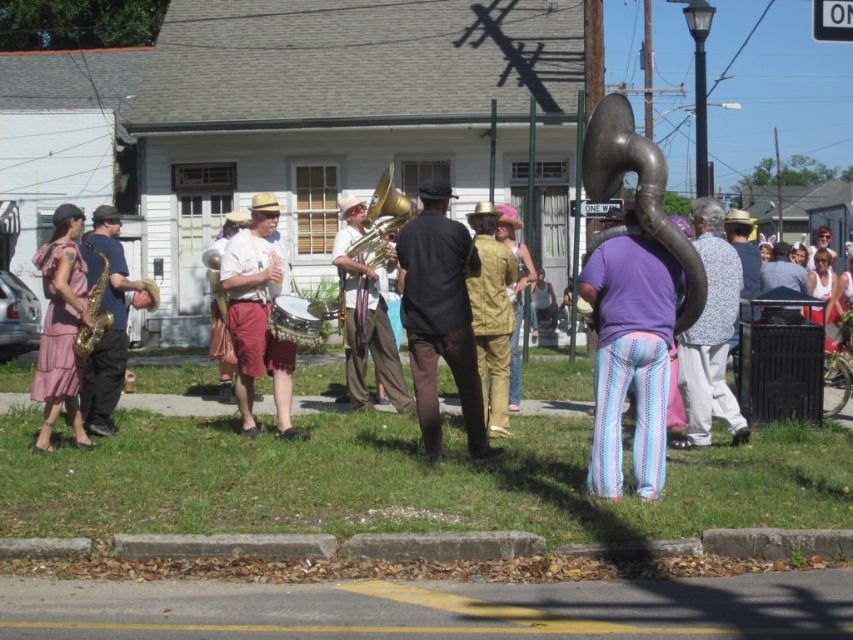
You are standing at the camera position and want to throw a ball to hit the point at coordinates [442,301]. What is the approximate distance you need to throw the ball?

The point at coordinates [442,301] is approximately 32.18 feet away from the camera, so you need to throw the ball about 32.18 feet.

You are a photographer standing 10 meters away from the light brown leather shorts at center and the light brown leather jacket at center. Can you fit both items in your camera frame if your camera has a maximum field of view of 12 meters width?

The light brown leather shorts at center and light brown leather jacket at center are 11.09 meters apart from each other. Since the distance between them is less than the camera field of view of 12 meters, both items can be captured in the frame.